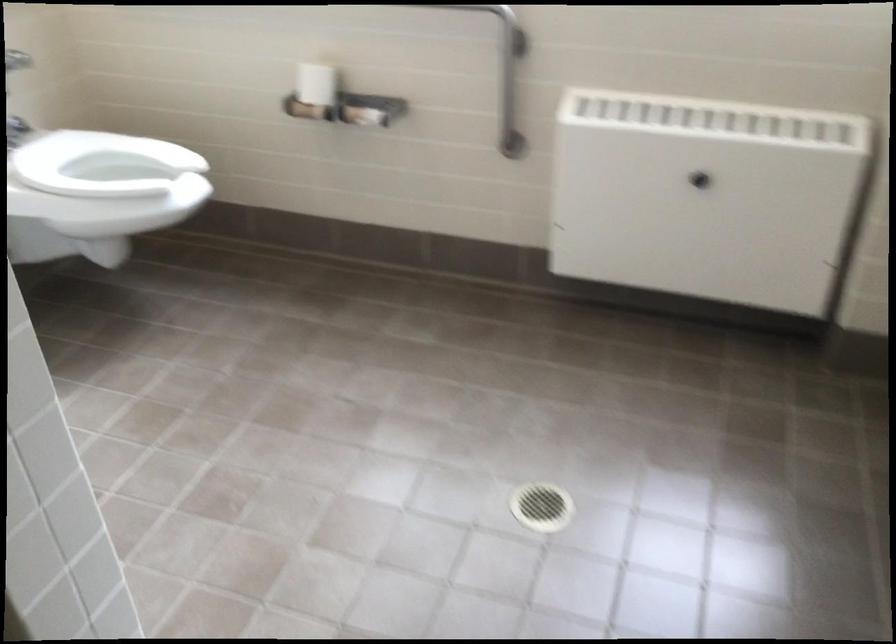
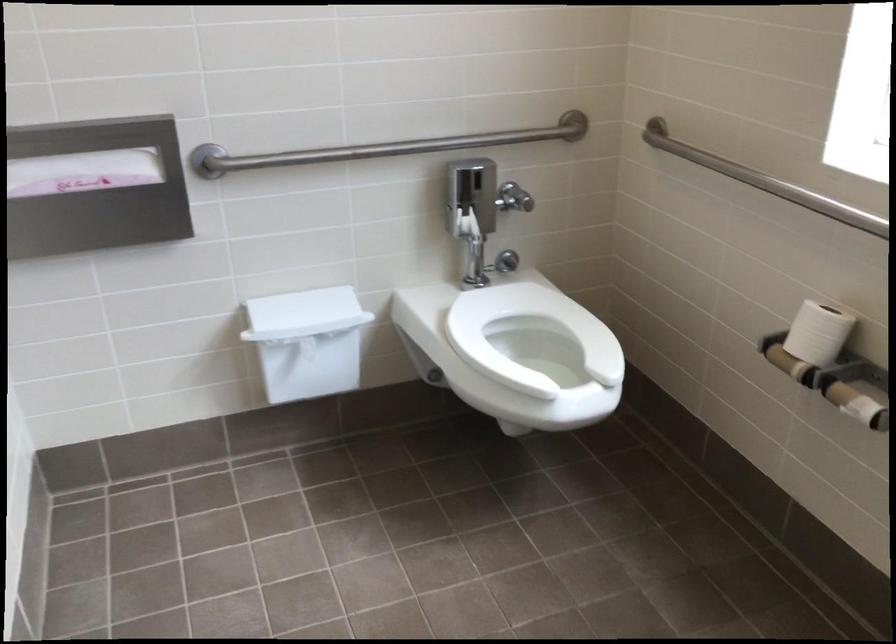
Locate, in the second image, the point that corresponds to point 363,118 in the first image.

(857, 404)